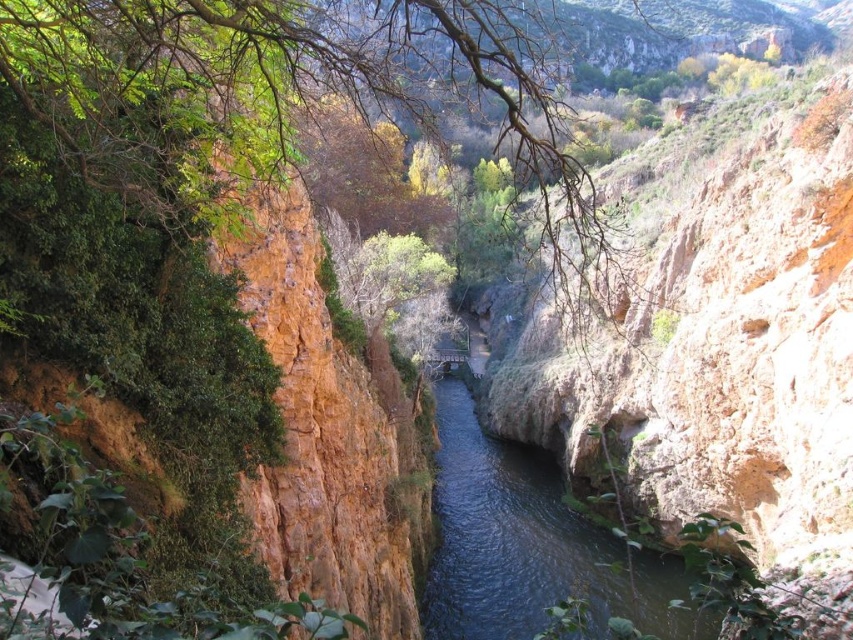
Is point (573, 220) in front of point (561, 579)?

That is True.

Who is positioned more to the right, green leafy tree at center or dark blue water at center?

green leafy tree at center

Which is behind, point (236, 81) or point (453, 378)?

Point (453, 378)

Identify the location of green leafy tree at center. This screenshot has width=853, height=640. (296, 96).